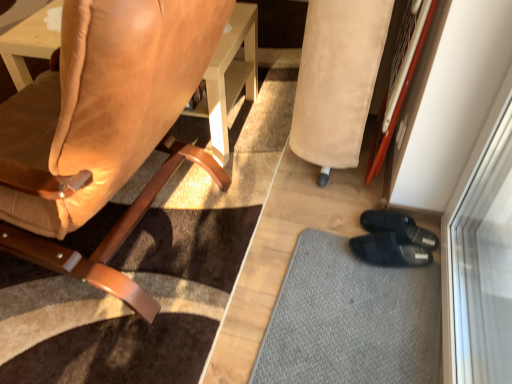
At what (x,y) coordinates should I click in order to perform the action: click on free space below beige suede bean bag chair at lower right (from a real-world perspective). Please return your answer as a coordinate pair (x, y). Looking at the image, I should click on (352, 176).